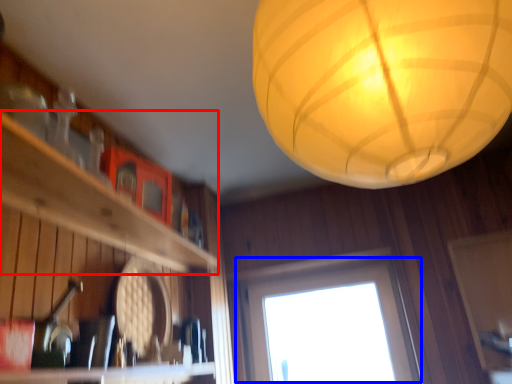
Question: Which point is further to the camera, shelf (highlighted by a red box) or window (highlighted by a blue box)?

Choices:
 (A) shelf
 (B) window

Answer: (B)